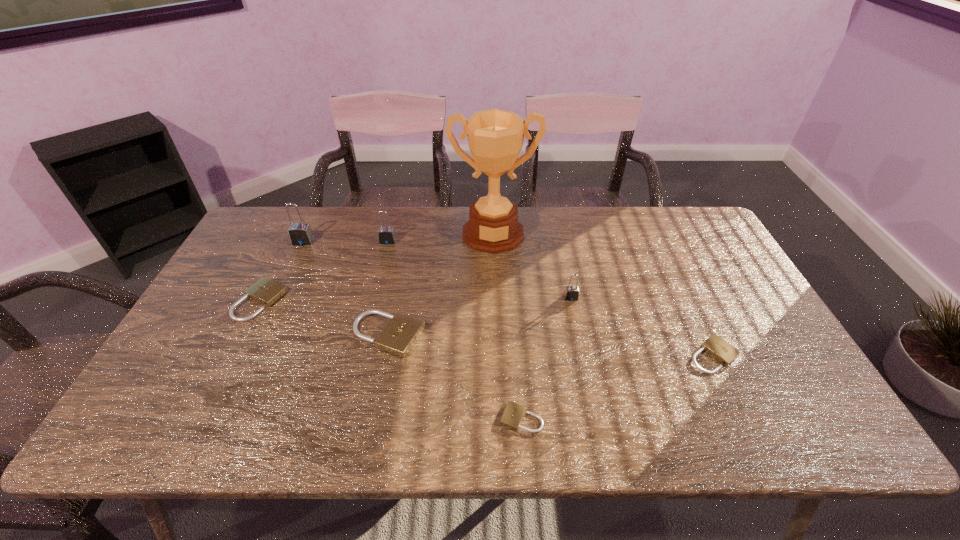
Identify the location of award. The height and width of the screenshot is (540, 960). (495, 137).

Image resolution: width=960 pixels, height=540 pixels. What are the coordinates of `the biggest gray padlock` in the screenshot? It's located at (300, 234).

This screenshot has width=960, height=540. I want to click on the tallest padlock, so click(x=300, y=234).

You are a GUI agent. You are given a task and a screenshot of the screen. Output one action in this format:
    pyautogui.click(x=<x>, y=<y>)
    Task: Click on the second biggest gray padlock
    The height and width of the screenshot is (540, 960).
    Given the screenshot: What is the action you would take?
    pyautogui.click(x=386, y=235)

Identify the location of the sixth shortest object. The image size is (960, 540). (386, 235).

The image size is (960, 540). Find the location of `the second padlock from right to left`. the second padlock from right to left is located at coordinates (571, 293).

Identify the location of the fourth tallest object. (571, 293).

Identify the location of the biggest beige padlock. This screenshot has width=960, height=540. (400, 334).

The height and width of the screenshot is (540, 960). What are the coordinates of `the third beige padlock from right to left` in the screenshot? It's located at (400, 334).

Locate an element on the screen. The image size is (960, 540). the third shortest object is located at coordinates (265, 291).